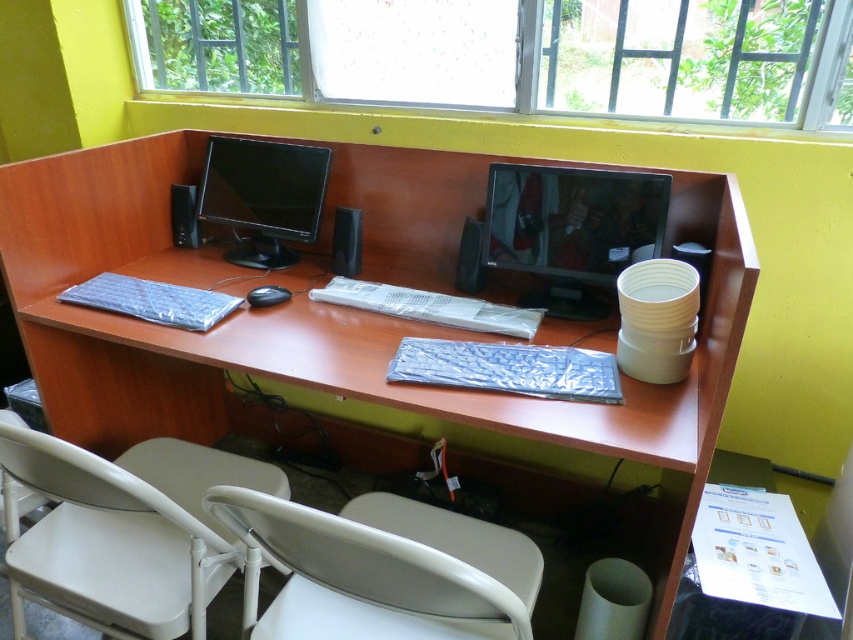
Can you confirm if white plastic swivel chair at lower left is shorter than matte black monitor at center?

Incorrect, white plastic swivel chair at lower left's height does not fall short of matte black monitor at center's.

Who is lower down, white plastic swivel chair at lower left or matte black monitor at center?

Positioned lower is white plastic swivel chair at lower left.

Between point (202, 538) and point (654, 182), which one is positioned in front?

Positioned in front is point (202, 538).

The width and height of the screenshot is (853, 640). I want to click on white plastic swivel chair at lower left, so pos(125,531).

Between white plastic swivel chair at lower center and black matte mouse at center, which one appears on the left side from the viewer's perspective?

Positioned to the left is black matte mouse at center.

Is white plastic swivel chair at lower center taller than black matte mouse at center?

Indeed, white plastic swivel chair at lower center has a greater height compared to black matte mouse at center.

This screenshot has height=640, width=853. What do you see at coordinates (384, 568) in the screenshot? I see `white plastic swivel chair at lower center` at bounding box center [384, 568].

Find the location of a particular element. Image resolution: width=853 pixels, height=640 pixels. white plastic swivel chair at lower center is located at coordinates (384, 568).

Between brown wood computer desk at center and white plastic swivel chair at lower center, which one is positioned higher?

Positioned higher is brown wood computer desk at center.

Between brown wood computer desk at center and white plastic swivel chair at lower center, which one has more height?

brown wood computer desk at center is taller.

Describe the element at coordinates (337, 317) in the screenshot. I see `brown wood computer desk at center` at that location.

Image resolution: width=853 pixels, height=640 pixels. Identify the location of brown wood computer desk at center. (337, 317).